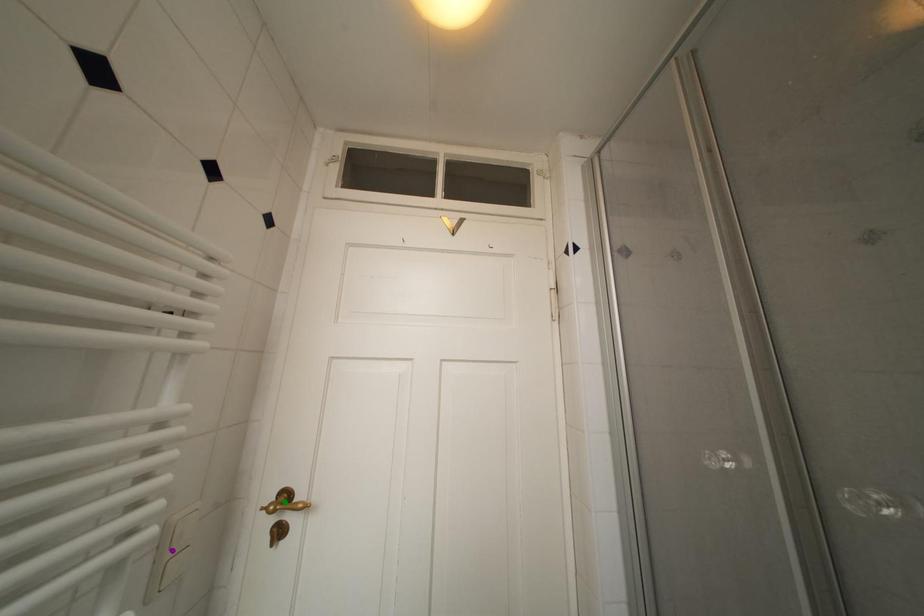
Order these from nearest to farthest:
- purple point
- green point
- blue point

1. purple point
2. blue point
3. green point